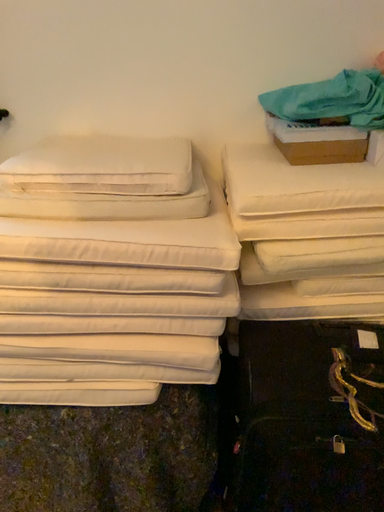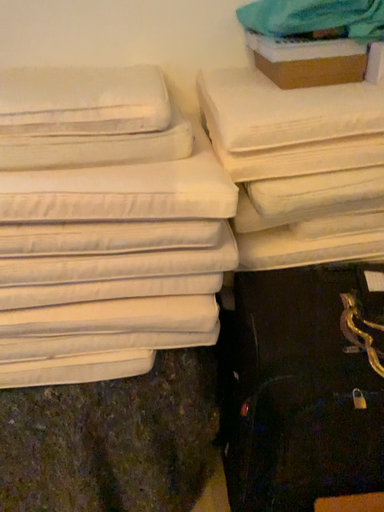
Question: How did the camera likely rotate when shooting the video?

Choices:
 (A) rotated downward
 (B) rotated upward

Answer: (A)